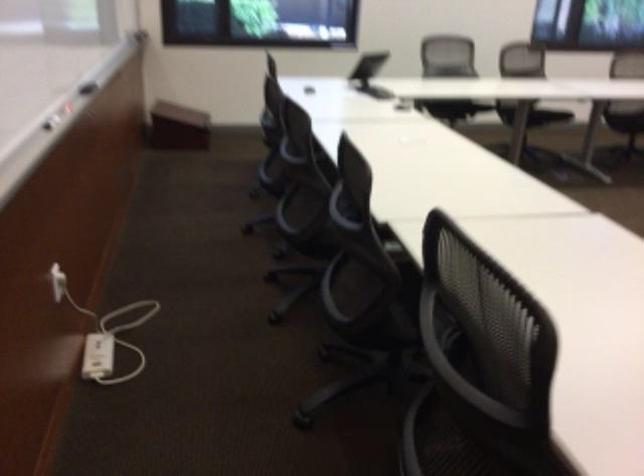
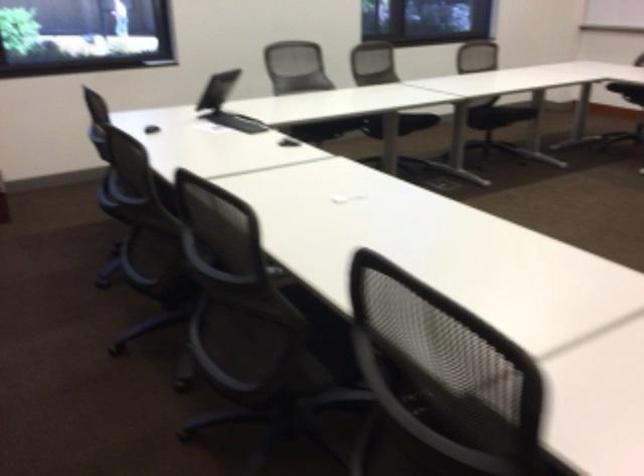
Question: In a continuous first-person perspective shot, in which direction is the camera moving?

Choices:
 (A) Left
 (B) Right
 (C) Forward
 (D) Backward

Answer: (D)